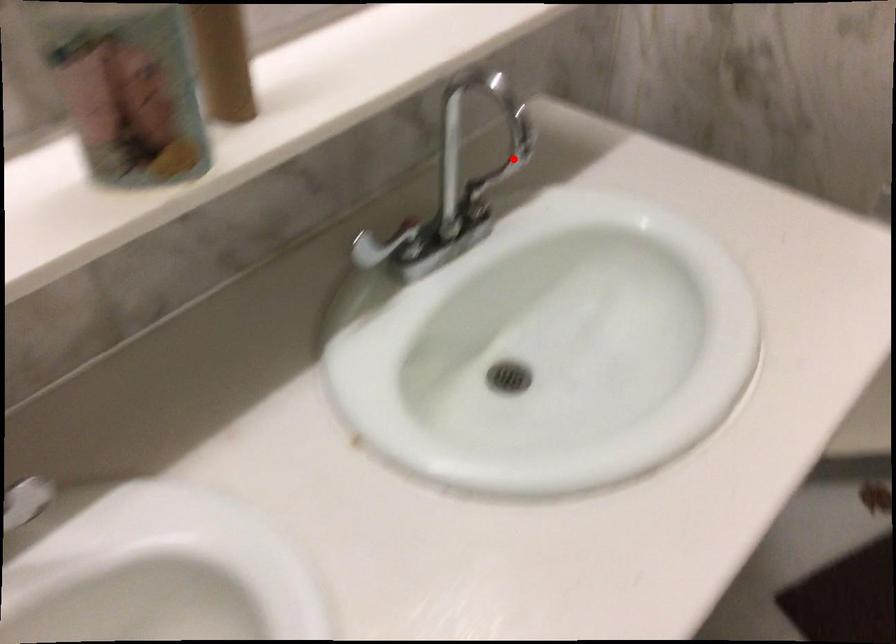
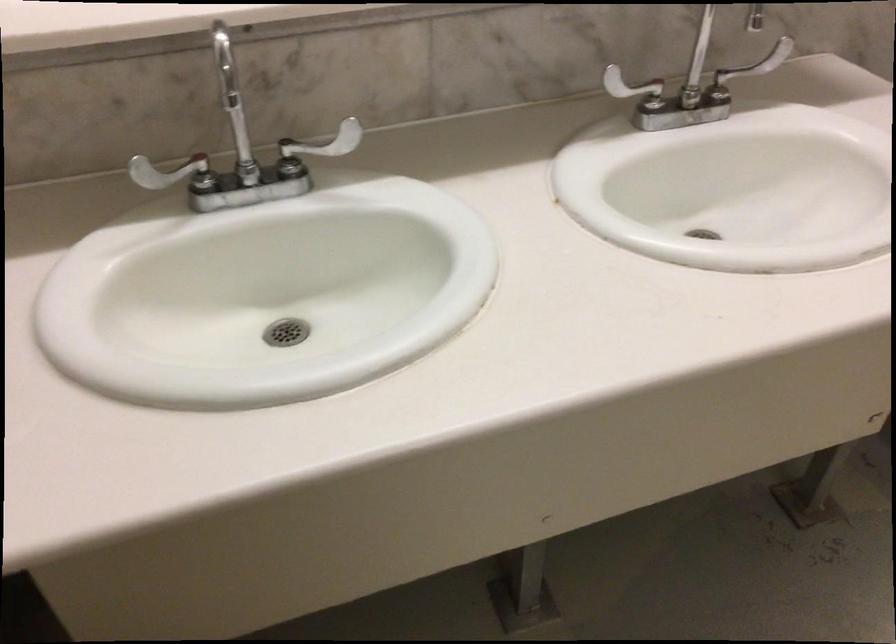
In the second image, find the point that corresponds to the highlighted location in the first image.

(759, 62)